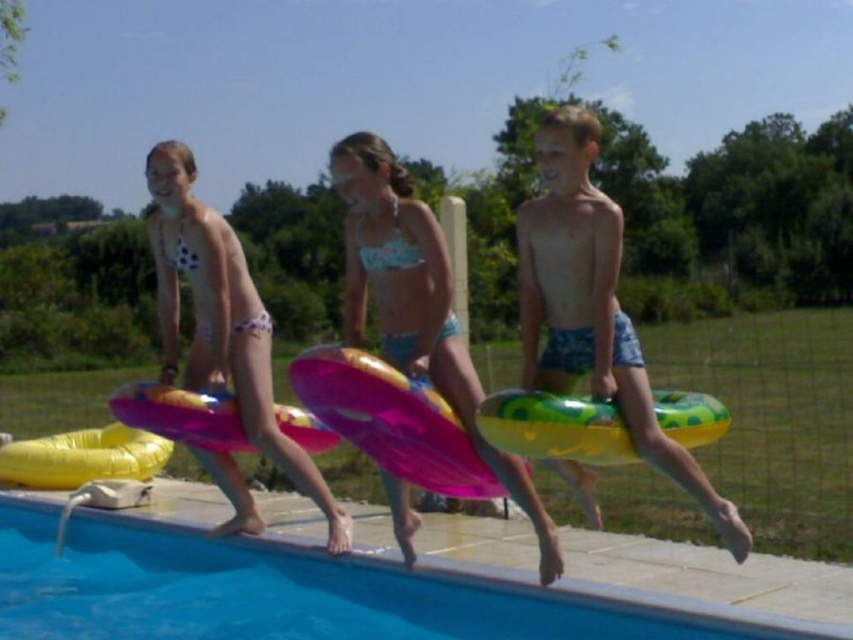
Which is behind, point (323, 584) or point (238, 266)?

The point (238, 266) is behind.

How much distance is there between blue smooth water at lower center and white polka dot bikini at center?

blue smooth water at lower center is 4.23 feet away from white polka dot bikini at center.

The image size is (853, 640). Identify the location of blue smooth water at lower center. (316, 588).

Measure the distance between light blue bikini at center and white polka dot bikini at center.

4.24 meters

Who is more distant from viewer, (410, 529) or (218, 289)?

The point (218, 289) is more distant.

Locate an element on the screen. This screenshot has width=853, height=640. light blue bikini at center is located at coordinates (416, 305).

Is blue smooth water at lower center above inflatable ring at right?

No.

Is blue smooth water at lower center below inflatable ring at right?

Yes, blue smooth water at lower center is below inflatable ring at right.

Measure the distance between blue smooth water at lower center and camera.

blue smooth water at lower center and camera are 4.53 meters apart from each other.

Find the location of `blue smooth water at lower center`. blue smooth water at lower center is located at coordinates (316, 588).